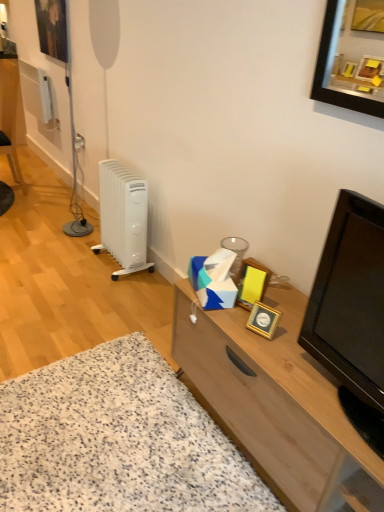
Where is `free spot in front of white plastic radiator at left`? free spot in front of white plastic radiator at left is located at coordinates (114, 290).